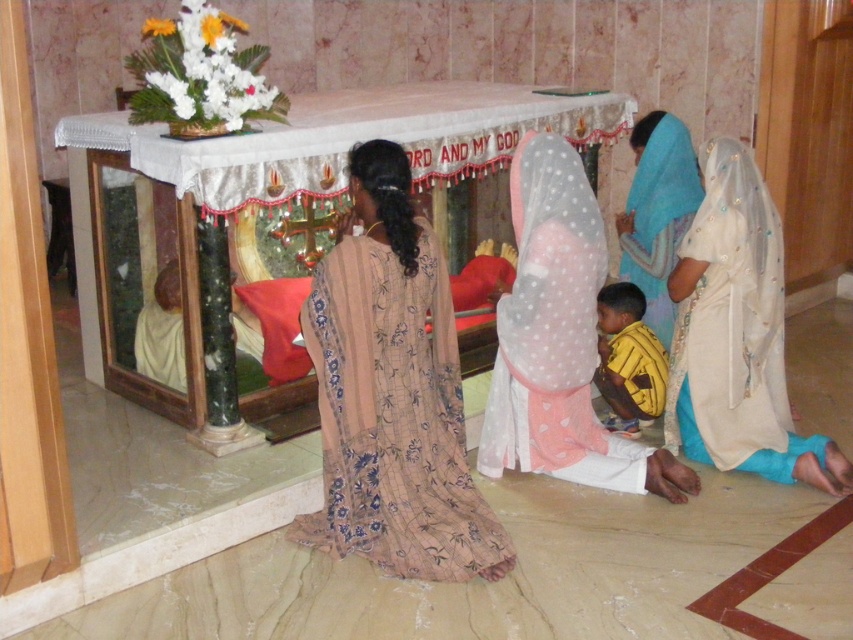
Question: Which object appears farthest from the camera in this image?

Choices:
 (A) white dotted fabric at center
 (B) beige floral dress at center
 (C) beige satin robe at lower right
 (D) yellow striped shirt at lower center

Answer: (D)

Question: Does beige floral dress at center have a smaller size compared to yellow striped shirt at lower center?

Choices:
 (A) no
 (B) yes

Answer: (A)

Question: Is beige satin robe at lower right positioned before light blue sheer fabric at lower right?

Choices:
 (A) no
 (B) yes

Answer: (B)

Question: Which object is positioned farthest from the yellow striped shirt at lower center?

Choices:
 (A) beige floral dress at center
 (B) beige satin robe at lower right
 (C) light blue sheer fabric at lower right
 (D) white dotted fabric at center

Answer: (A)

Question: Is beige floral dress at center smaller than yellow striped shirt at lower center?

Choices:
 (A) yes
 (B) no

Answer: (B)

Question: Estimate the real-world distances between objects in this image. Which object is farther from the yellow striped shirt at lower center?

Choices:
 (A) light blue sheer fabric at lower right
 (B) white dotted fabric at center
 (C) beige satin robe at lower right
 (D) beige floral dress at center

Answer: (D)